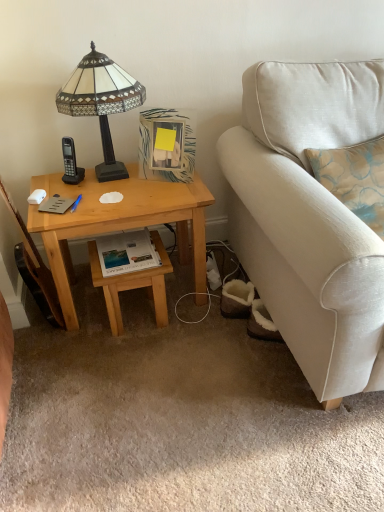
Locate an element on the screen. The width and height of the screenshot is (384, 512). white glossy book at center is located at coordinates (127, 252).

Who is shorter, white glossy book at center or light wood desk at left?

With less height is white glossy book at center.

Which is correct: white glossy book at center is inside light wood desk at left, or outside of it?

white glossy book at center can be found inside light wood desk at left.

Is white glossy book at center not close to light wood desk at left?

No, there isn't a large distance between white glossy book at center and light wood desk at left.

Is white glossy book at center smaller than light wood desk at left?

Yes.

From the image's perspective, which one is positioned higher, stained glass lampshade at upper left or white glossy book at center?

stained glass lampshade at upper left is shown above in the image.

Which object is closer to the camera, stained glass lampshade at upper left or white glossy book at center?

stained glass lampshade at upper left is in front.

Is stained glass lampshade at upper left looking in the opposite direction of white glossy book at center?

No, stained glass lampshade at upper left is not facing the opposite direction of white glossy book at center.

Is stained glass lampshade at upper left wider than white glossy book at center?

Yes, stained glass lampshade at upper left is wider than white glossy book at center.

Is light wood stool at lower center inside the boundaries of white glossy book at center, or outside?

light wood stool at lower center is spatially situated outside white glossy book at center.

Which of these two, light wood stool at lower center or white glossy book at center, stands shorter?

white glossy book at center is shorter.

Is light wood stool at lower center aimed at white glossy book at center?

No, light wood stool at lower center is not turned towards white glossy book at center.

Considering the relative sizes of light wood stool at lower center and beige fabric couch at right in the image provided, is light wood stool at lower center bigger than beige fabric couch at right?

Incorrect, light wood stool at lower center is not larger than beige fabric couch at right.

Does point (126, 277) come behind point (269, 120)?

Yes, it is.

From the image's perspective, is light wood stool at lower center located above beige fabric couch at right?

No, from the image's perspective, light wood stool at lower center is not on top of beige fabric couch at right.

Is light wood stool at lower center located outside beige fabric couch at right?

Yes.

Is light wood desk at left not within stained glass lampshade at upper left?

Yes, light wood desk at left is not within stained glass lampshade at upper left.

Does point (114, 333) lie behind point (58, 91)?

Yes, it is.

Could you tell me if light wood desk at left is facing stained glass lampshade at upper left?

No.

Can you tell me how much light wood desk at left and stained glass lampshade at upper left differ in facing direction?

2.38 degrees separate the facing orientations of light wood desk at left and stained glass lampshade at upper left.

Does beige fabric couch at right have a lesser height compared to stained glass lampshade at upper left?

No.

From a real-world perspective, which is physically above, beige fabric couch at right or stained glass lampshade at upper left?

stained glass lampshade at upper left, from a real-world perspective.

Looking at this image, would you say beige fabric couch at right is inside or outside stained glass lampshade at upper left?

beige fabric couch at right lies outside stained glass lampshade at upper left.

Could you tell me if beige fabric couch at right is facing stained glass lampshade at upper left?

No, beige fabric couch at right does not turn towards stained glass lampshade at upper left.

Considering the positions of point (135, 262) and point (341, 362), is point (135, 262) closer or farther from the camera than point (341, 362)?

Point (135, 262).

Which of these two, white glossy book at center or beige fabric couch at right, is wider?

Wider between the two is beige fabric couch at right.

Considering the relative sizes of white glossy book at center and beige fabric couch at right in the image provided, is white glossy book at center shorter than beige fabric couch at right?

Correct, white glossy book at center is not as tall as beige fabric couch at right.

Which of these two, white glossy book at center or beige fabric couch at right, is bigger?

beige fabric couch at right is bigger.

You are a GUI agent. You are given a task and a screenshot of the screen. Output one action in this format:
    pyautogui.click(x=<x>, y=<y>)
    Task: Click on the book lying behind the light wood desk at left
    
    Given the screenshot: What is the action you would take?
    pos(127,252)

The width and height of the screenshot is (384, 512). What are the coordinates of `lamp located above the white glossy book at center (from the image's perspective)` in the screenshot? It's located at (101, 102).

When comparing their distances from light wood stool at lower center, does light wood desk at left or beige fabric couch at right seem further?

Among the two, beige fabric couch at right is located further to light wood stool at lower center.

From the image, which object appears to be farther from stained glass lampshade at upper left, beige fabric couch at right or light wood stool at lower center?

The object further to stained glass lampshade at upper left is beige fabric couch at right.

When comparing their distances from light wood stool at lower center, does white glossy book at center or light wood desk at left seem further?

light wood desk at left is further to light wood stool at lower center.

Which object lies nearer to the anchor point light wood stool at lower center, stained glass lampshade at upper left or beige fabric couch at right?

Among the two, stained glass lampshade at upper left is located nearer to light wood stool at lower center.

Considering their positions, is light wood desk at left positioned further to white glossy book at center than beige fabric couch at right?

The object further to white glossy book at center is beige fabric couch at right.

From the image, which object appears to be nearer to beige fabric couch at right, light wood stool at lower center or light wood desk at left?

light wood desk at left is positioned closer to the anchor beige fabric couch at right.

Based on the photo, from the image, which object appears to be farther from beige fabric couch at right, light wood stool at lower center or stained glass lampshade at upper left?

stained glass lampshade at upper left is positioned further to the anchor beige fabric couch at right.

Looking at the image, which one is located closer to light wood desk at left, beige fabric couch at right or light wood stool at lower center?

Based on the image, light wood stool at lower center appears to be nearer to light wood desk at left.

Image resolution: width=384 pixels, height=512 pixels. Find the location of `desk between stained glass lampshade at upper left and beige fabric couch at right in the horizontal direction`. desk between stained glass lampshade at upper left and beige fabric couch at right in the horizontal direction is located at coordinates coord(119,221).

Where is `stool located between light wood desk at left and beige fabric couch at right in the left-right direction`? The height and width of the screenshot is (512, 384). stool located between light wood desk at left and beige fabric couch at right in the left-right direction is located at coordinates 132,285.

Image resolution: width=384 pixels, height=512 pixels. What are the coordinates of `book between stained glass lampshade at upper left and beige fabric couch at right from left to right` in the screenshot? It's located at (127, 252).

Identify the location of stool between white glossy book at center and beige fabric couch at right from left to right. Image resolution: width=384 pixels, height=512 pixels. (132, 285).